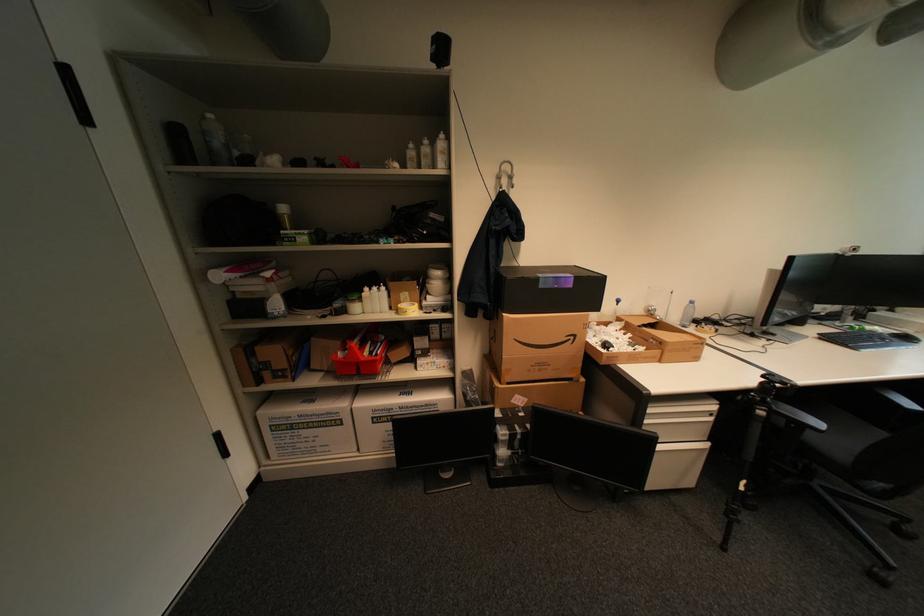
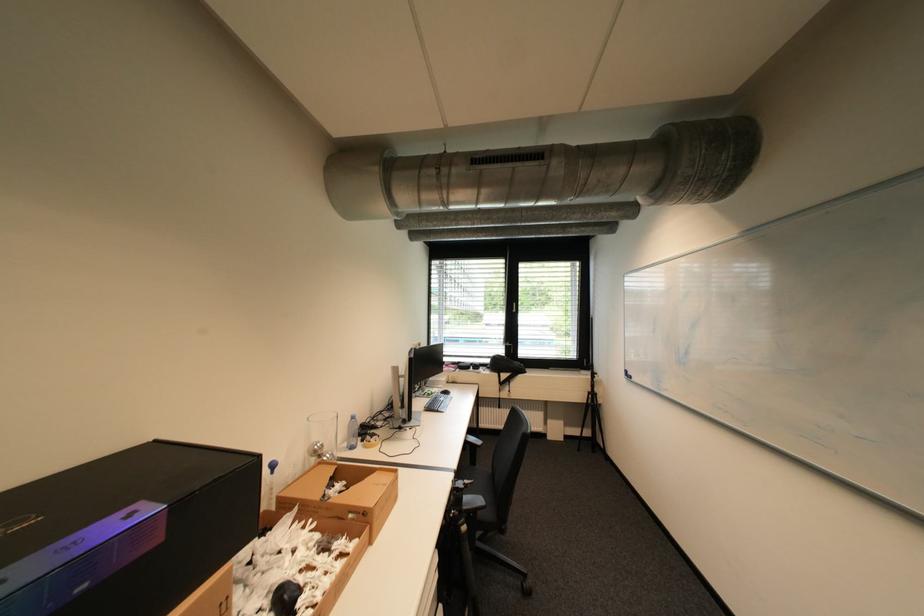
Question: The camera is either moving clockwise (left) or counter-clockwise (right) around the object. The first image is from the beginning of the video and the second image is from the end. Is the camera moving left or right when shooting the video?

Choices:
 (A) Left
 (B) Right

Answer: (A)